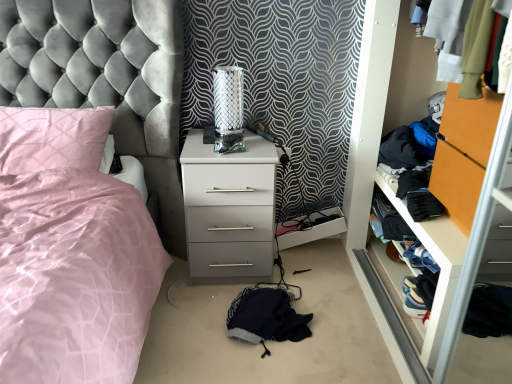
Find the location of `vacant space in between white glossy chest of drawers at center and denim fabric clothes at right`. vacant space in between white glossy chest of drawers at center and denim fabric clothes at right is located at coordinates (337, 296).